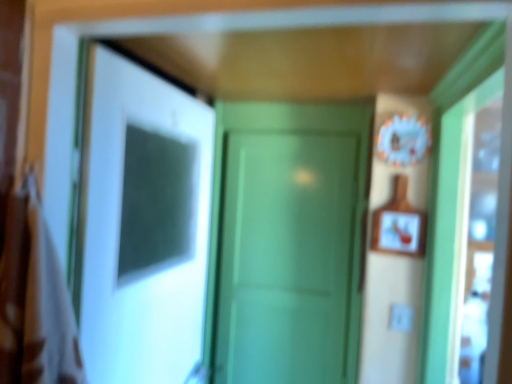
Question: Considering the positions of point (338, 296) and point (39, 332), is point (338, 296) closer or farther from the camera than point (39, 332)?

Choices:
 (A) closer
 (B) farther

Answer: (B)

Question: Looking at their shapes, would you say green matte door at center, which is counted as the first door, starting from the back, is wider or thinner than brown fabric laundry at left?

Choices:
 (A) wide
 (B) thin

Answer: (B)

Question: Which object is positioned closest to the brown fabric laundry at left?

Choices:
 (A) white glossy door at center, the 1th door from the left
 (B) wooden framed picture at right
 (C) green matte door at center, which is counted as the first door, starting from the back

Answer: (A)

Question: Which of these objects is positioned closest to the wooden framed picture at right?

Choices:
 (A) brown fabric laundry at left
 (B) white glossy door at center, the 1th door from the left
 (C) green matte door at center, acting as the second door starting from the front

Answer: (C)